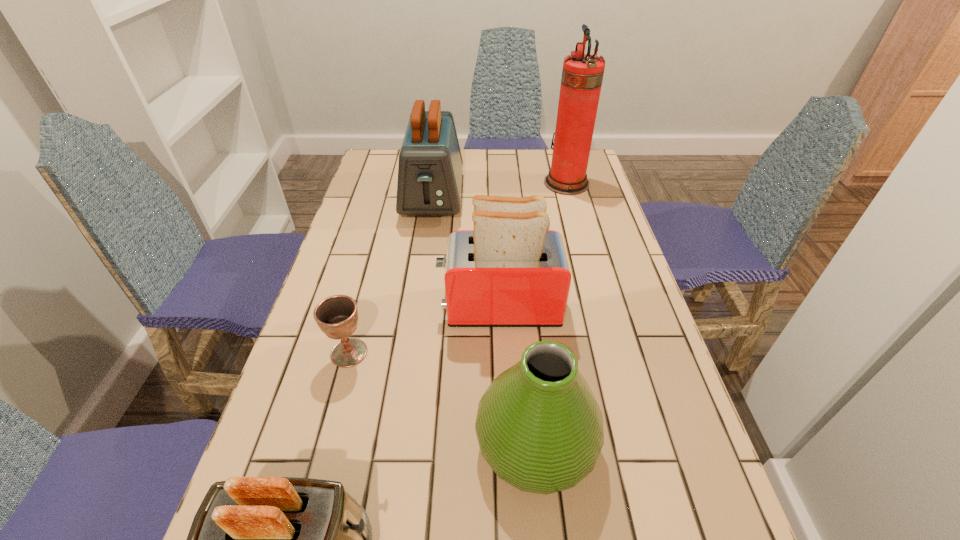
Where is `object located at the far left corner`? object located at the far left corner is located at coordinates (430, 166).

What are the coordinates of `object present at the far right corner` in the screenshot? It's located at click(x=582, y=75).

Where is `vacant space at the far edge`? This screenshot has width=960, height=540. vacant space at the far edge is located at coordinates (523, 180).

In the image, there is a desktop. Where is `vacant space at the left edge`? This screenshot has height=540, width=960. vacant space at the left edge is located at coordinates coord(390,196).

In the image, there is a desktop. Where is `free space at the right edge`? free space at the right edge is located at coordinates (596, 315).

Identify the location of free space at the far left corner of the desktop. (383, 156).

I want to click on unoccupied position between the vase and the fourth farthest object, so click(443, 398).

Locate which object ranks in proximity to the shortest toaster. Please provide its 2D coordinates. Your answer should be formatted as a tuple, i.e. [(x, y)], where the tuple contains the x and y coordinates of a point satisfying the conditions above.

[(539, 427)]

Identify which object is located as the second nearest to the farthest toaster. Please provide its 2D coordinates. Your answer should be formatted as a tuple, i.e. [(x, y)], where the tuple contains the x and y coordinates of a point satisfying the conditions above.

[(582, 75)]

The image size is (960, 540). I want to click on toaster that is the closest to the vase, so [x=253, y=539].